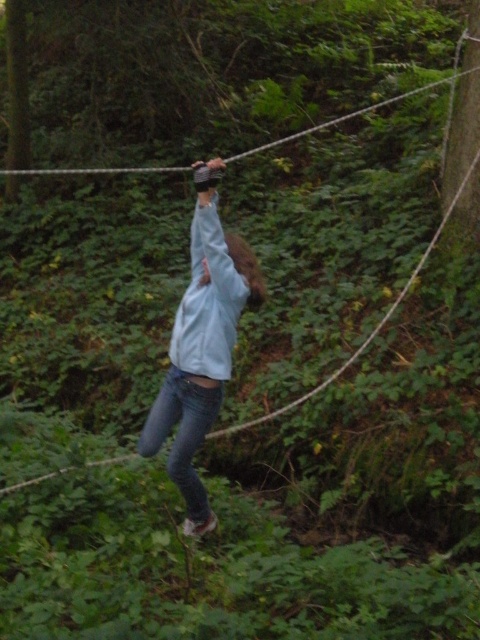
Which is behind, point (204, 276) or point (142, 452)?

The point (142, 452) is behind.

Who is more forward, (215, 266) or (186, 397)?

Point (215, 266)

Is point (191, 412) positioned after point (180, 484)?

No, (191, 412) is in front of (180, 484).

Identify the location of light blue fabric at center. click(x=202, y=344).